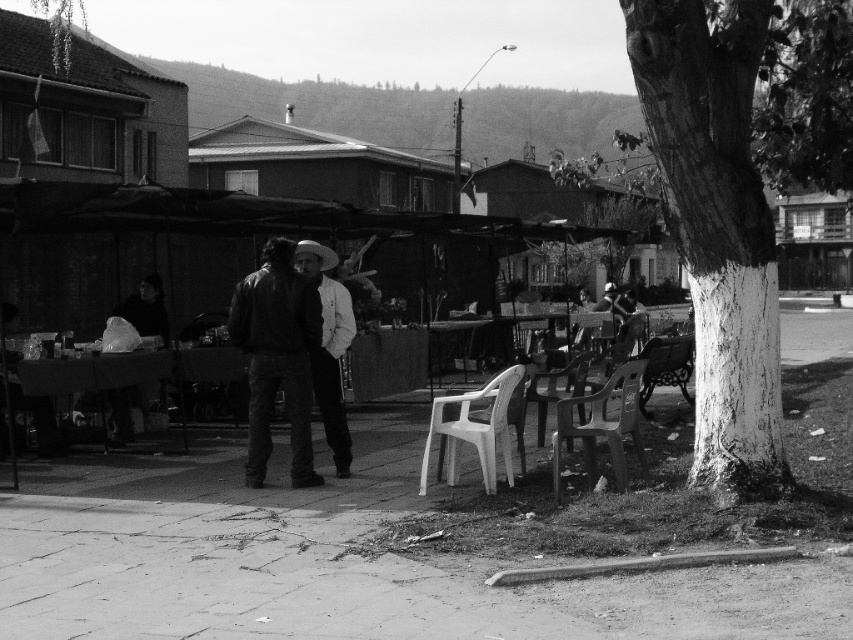
You need to place a large box on the smooth concrete pavement at center and the plastic white table at center. Based on their sizes, which surface can accommodate the box more comfortably?

The smooth concrete pavement at center is larger in size than the plastic white table at center, so the box can be placed more comfortably on the smooth concrete pavement at center.

You are a delivery person who needs to place a large package between the plastic white table at center and the metallic polished bench at lower right. The package requires 5 meters of space. Is there enough space between them to fit the package?

The distance between the plastic white table at center and the metallic polished bench at lower right is 5.60 meters, which is more than enough to accommodate the package requiring 5 meters of space.

You are standing at the center of the image and want to move towards the white plastic chair at lower center. Based on its position, in which direction should you walk?

The white plastic chair at lower center is located at point 0.670 on the x axis and 0.557 on the y axis. Since you are at the center of the image, which is point 0.5 on both axes, you should walk towards the right and slightly upwards to reach it.